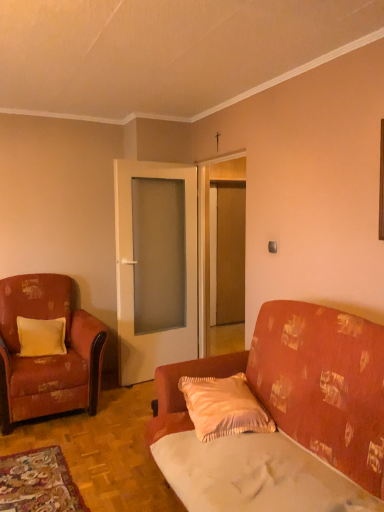
Question: From the image's perspective, is pink satin pillow at center, the 2th pillow in the back-to-front sequence, above distressed fabric armchair at left?

Choices:
 (A) yes
 (B) no

Answer: (B)

Question: Does pink satin pillow at center, the first pillow viewed from the right, have a smaller size compared to distressed fabric armchair at left?

Choices:
 (A) yes
 (B) no

Answer: (A)

Question: Is pink satin pillow at center, which ranks as the first pillow in front-to-back order, positioned beyond the bounds of distressed fabric armchair at left?

Choices:
 (A) no
 (B) yes

Answer: (B)

Question: Is the depth of pink satin pillow at center, which ranks as the first pillow in front-to-back order, less than that of distressed fabric armchair at left?

Choices:
 (A) no
 (B) yes

Answer: (B)

Question: Is pink satin pillow at center, the first pillow viewed from the right, beside distressed fabric armchair at left?

Choices:
 (A) yes
 (B) no

Answer: (B)

Question: Considering the positions of point (238, 395) and point (160, 355), is point (238, 395) closer or farther from the camera than point (160, 355)?

Choices:
 (A) farther
 (B) closer

Answer: (B)

Question: Is pink satin pillow at center, which ranks as the second pillow in left-to-right order, taller or shorter than white glass door at center, arranged as the 2th door when viewed from the right?

Choices:
 (A) tall
 (B) short

Answer: (B)

Question: In the image, is pink satin pillow at center, the first pillow viewed from the right, on the left side or the right side of white glass door at center, arranged as the 2th door when viewed from the right?

Choices:
 (A) right
 (B) left

Answer: (A)

Question: Is pink satin pillow at center, which ranks as the first pillow in front-to-back order, bigger or smaller than white glass door at center, positioned as the 1th door in left-to-right order?

Choices:
 (A) small
 (B) big

Answer: (A)

Question: Considering the positions of distressed fabric armchair at left and yellow satin pillow at left, which ranks as the 2th pillow in right-to-left order, in the image, is distressed fabric armchair at left bigger or smaller than yellow satin pillow at left, which ranks as the 2th pillow in right-to-left order,?

Choices:
 (A) big
 (B) small

Answer: (A)

Question: From a real-world perspective, is distressed fabric armchair at left above or below yellow satin pillow at left, which ranks as the 2th pillow in front-to-back order?

Choices:
 (A) below
 (B) above

Answer: (A)

Question: Considering the positions of distressed fabric armchair at left and yellow satin pillow at left, which ranks as the 2th pillow in right-to-left order, in the image, is distressed fabric armchair at left wider or thinner than yellow satin pillow at left, which ranks as the 2th pillow in right-to-left order,?

Choices:
 (A) wide
 (B) thin

Answer: (A)

Question: From their relative heights in the image, would you say distressed fabric armchair at left is taller or shorter than yellow satin pillow at left, which ranks as the 2th pillow in front-to-back order?

Choices:
 (A) tall
 (B) short

Answer: (A)

Question: Choose the correct answer: Is pink satin pillow at center, the 2th pillow in the back-to-front sequence, inside white fabric sheet at lower right or outside it?

Choices:
 (A) inside
 (B) outside

Answer: (B)

Question: Is point (228, 388) closer or farther from the camera than point (276, 455)?

Choices:
 (A) closer
 (B) farther

Answer: (B)